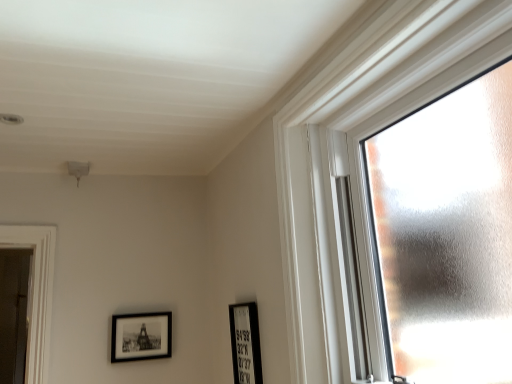
Question: Considering the relative sizes of frosted glass window at right and black matte picture frame at lower left, which ranks as the 2th picture frame in right-to-left order, in the image provided, is frosted glass window at right thinner than black matte picture frame at lower left, which ranks as the 2th picture frame in right-to-left order,?

Choices:
 (A) no
 (B) yes

Answer: (A)

Question: From the image's perspective, is frosted glass window at right located above black matte picture frame at lower left, acting as the 1th picture frame starting from the back?

Choices:
 (A) no
 (B) yes

Answer: (B)

Question: Does frosted glass window at right have a greater height compared to black matte picture frame at lower left, which ranks as the 2th picture frame in right-to-left order?

Choices:
 (A) yes
 (B) no

Answer: (A)

Question: Is frosted glass window at right at the left side of black matte picture frame at lower left, which appears as the 2th picture frame when viewed from the front?

Choices:
 (A) yes
 (B) no

Answer: (B)

Question: From a real-world perspective, is frosted glass window at right located higher than black matte picture frame at lower left, which appears as the 2th picture frame when viewed from the front?

Choices:
 (A) yes
 (B) no

Answer: (A)

Question: Considering their positions, is frosted glass window at right located in front of or behind black matte picture frame at lower left, which ranks as the 2th picture frame in right-to-left order?

Choices:
 (A) behind
 (B) front

Answer: (B)

Question: Does point (291, 322) appear closer or farther from the camera than point (120, 319)?

Choices:
 (A) closer
 (B) farther

Answer: (A)

Question: Based on their sizes in the image, would you say frosted glass window at right is bigger or smaller than black matte picture frame at lower left, which appears as the 2th picture frame when viewed from the front?

Choices:
 (A) small
 (B) big

Answer: (B)

Question: From their relative heights in the image, would you say frosted glass window at right is taller or shorter than black matte picture frame at lower left, which appears as the 2th picture frame when viewed from the front?

Choices:
 (A) tall
 (B) short

Answer: (A)

Question: Looking at their shapes, would you say frosted glass window at right is wider or thinner than black matte picture frame at lower center, which ranks as the second picture frame in left-to-right order?

Choices:
 (A) wide
 (B) thin

Answer: (A)

Question: Relative to black matte picture frame at lower center, placed as the 1th picture frame when sorted from front to back, is frosted glass window at right in front or behind?

Choices:
 (A) behind
 (B) front

Answer: (B)

Question: Looking at the image, does frosted glass window at right seem bigger or smaller compared to black matte picture frame at lower center, the 1th picture frame in the right-to-left sequence?

Choices:
 (A) small
 (B) big

Answer: (B)

Question: From a real-world perspective, is frosted glass window at right positioned above or below black matte picture frame at lower center, placed as the 1th picture frame when sorted from front to back?

Choices:
 (A) above
 (B) below

Answer: (A)

Question: Does point (259, 372) appear closer or farther from the camera than point (359, 208)?

Choices:
 (A) closer
 (B) farther

Answer: (B)

Question: From the image's perspective, is black matte picture frame at lower center, the second picture frame when ordered from back to front, above or below frosted glass window at right?

Choices:
 (A) below
 (B) above

Answer: (A)